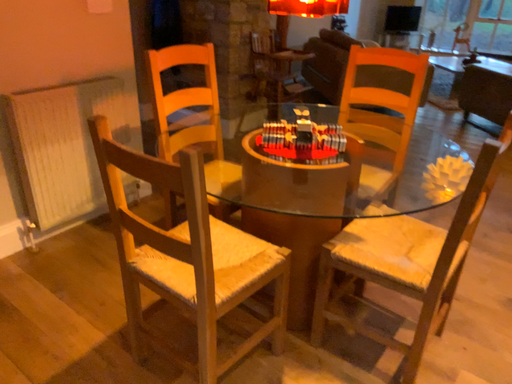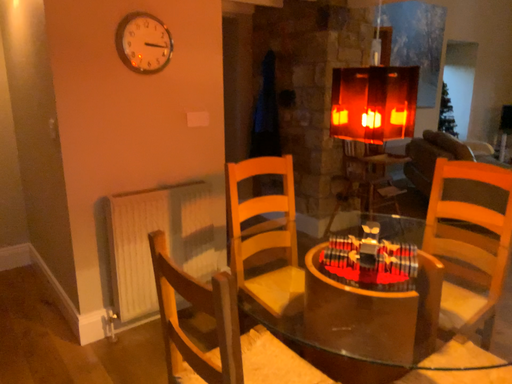
Question: Which way did the camera rotate in the video?

Choices:
 (A) rotated right
 (B) rotated left

Answer: (B)